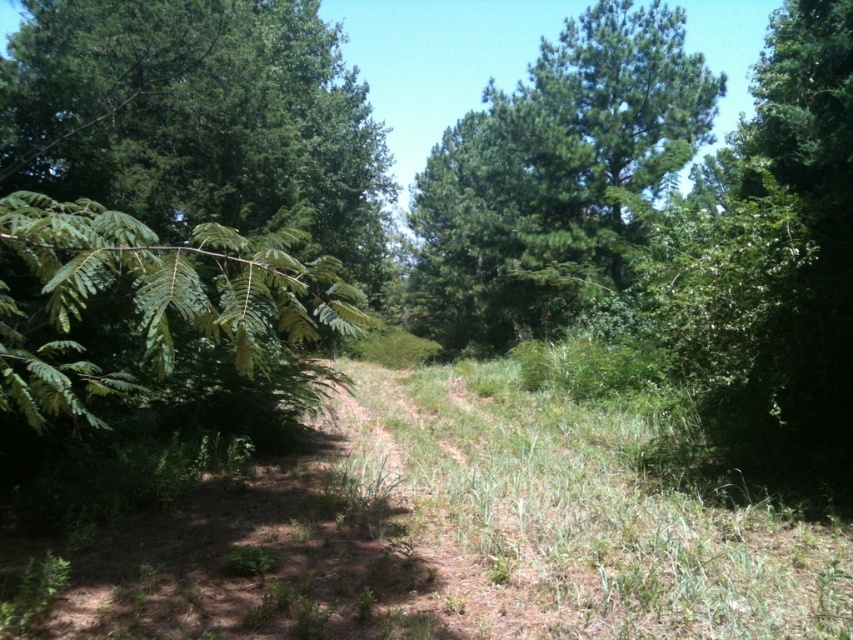
You are standing on the dirt path in the middle of the scene. You see a green leafy branch at left and a green leafy tree at upper center. Which one has a wider spread of leaves?

The green leafy branch at left might be wider than green leafy tree at upper center according to the description.